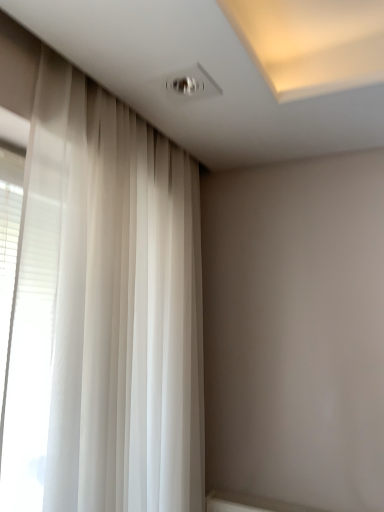
Identify the location of white sheer curtain at left. This screenshot has height=512, width=384. (115, 301).

This screenshot has width=384, height=512. Describe the element at coordinates (115, 301) in the screenshot. I see `white sheer curtain at left` at that location.

The width and height of the screenshot is (384, 512). Identify the location of white sheer curtain at left. (115, 301).